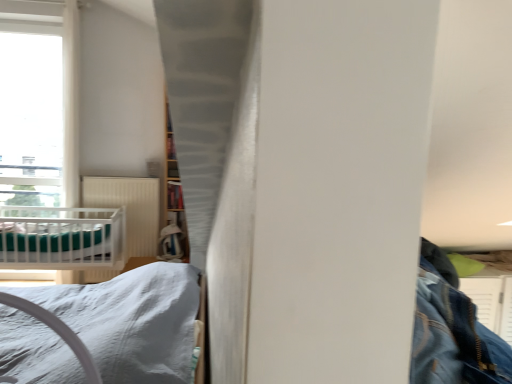
Question: Do you think wooden bookshelf at center is within white ribbed radiator at center, or outside of it?

Choices:
 (A) outside
 (B) inside

Answer: (A)

Question: From a real-world perspective, is wooden bookshelf at center physically located above or below white ribbed radiator at center?

Choices:
 (A) below
 (B) above

Answer: (B)

Question: Considering the real-world distances, which object is farthest from the white satin bed at lower left?

Choices:
 (A) white ribbed radiator at center
 (B) teal fabric sheet at left
 (C) wooden bookshelf at center

Answer: (A)

Question: Which object is the farthest from the white satin bed at lower left?

Choices:
 (A) teal fabric sheet at left
 (B) white ribbed radiator at center
 (C) wooden bookshelf at center

Answer: (B)